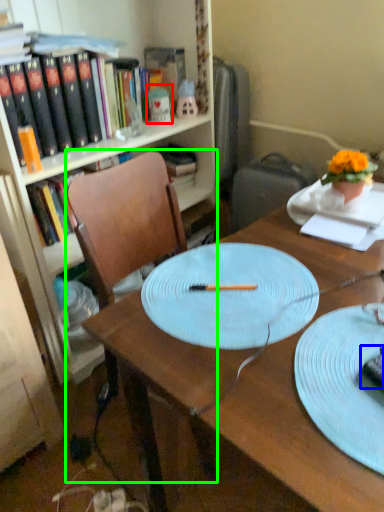
Question: Estimate the real-world distances between objects in this image. Which object is farther from toy (highlighted by a red box), chocolate cake (highlighted by a blue box) or chair (highlighted by a green box)?

Choices:
 (A) chocolate cake
 (B) chair

Answer: (A)